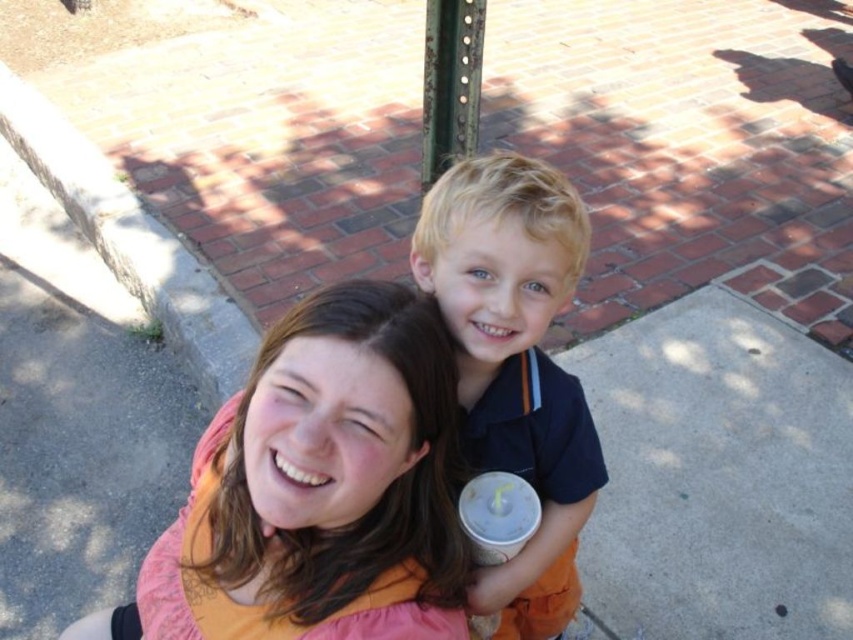
Question: Which object appears farthest from the camera in this image?

Choices:
 (A) blonde hair boy at center
 (B) matte orange shirt at center
 (C) white paper cup at center

Answer: (C)

Question: Can you confirm if matte orange shirt at center is bigger than white paper cup at center?

Choices:
 (A) yes
 (B) no

Answer: (A)

Question: Where is matte orange shirt at center located in relation to white paper cup at center in the image?

Choices:
 (A) left
 (B) right

Answer: (A)

Question: Which object is farther from the camera taking this photo?

Choices:
 (A) matte orange shirt at center
 (B) white paper cup at center

Answer: (B)

Question: From the image, what is the correct spatial relationship of blonde hair boy at center in relation to white paper cup at center?

Choices:
 (A) below
 (B) above

Answer: (B)

Question: Estimate the real-world distances between objects in this image. Which object is closer to the matte orange shirt at center?

Choices:
 (A) blonde hair boy at center
 (B) white paper cup at center

Answer: (A)